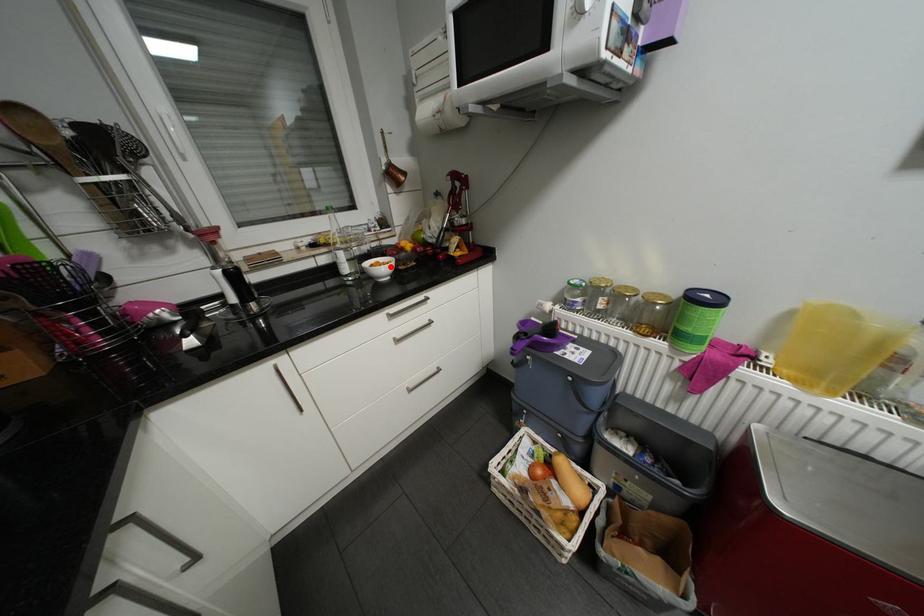
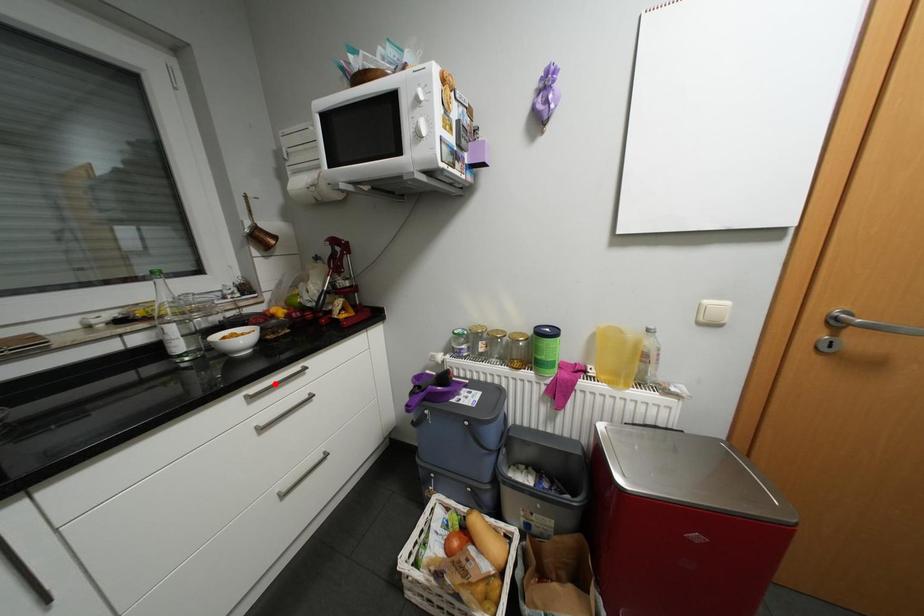
I am providing you with two images of the same scene from different viewpoints. A red point is marked on the first image and another point is marked on the second image. Does the point marked in image1 correspond to the same location as the one in image2?

No